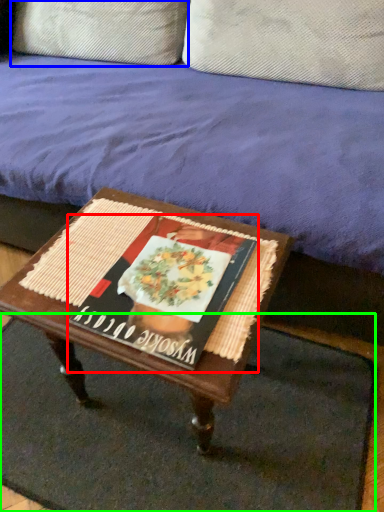
Question: Based on their relative distances, which object is farther from magazine (highlighted by a red box)? Choose from pillow (highlighted by a blue box) and doormat (highlighted by a green box).

Choices:
 (A) pillow
 (B) doormat

Answer: (A)